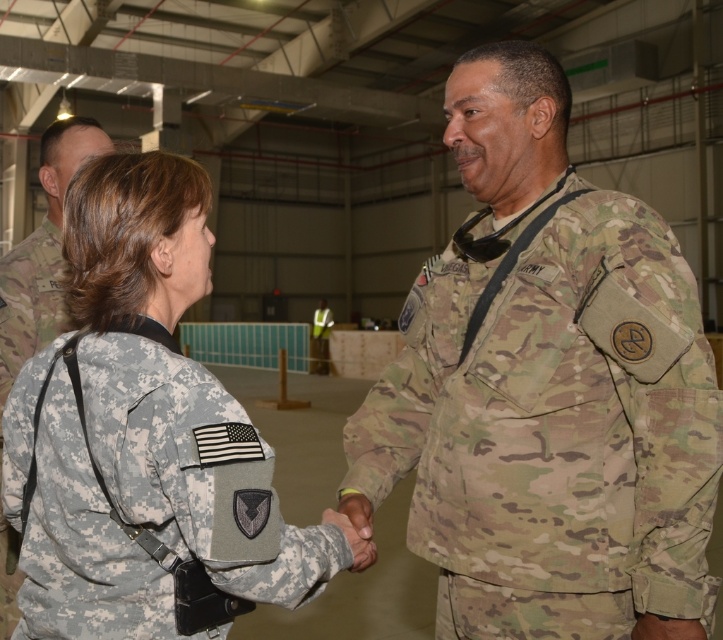
Is camo uniform at center thinner than camouflage uniform at center?

Correct, camo uniform at center's width is less than camouflage uniform at center's.

Between point (603, 252) and point (1, 413), which one is positioned in front?

Point (603, 252)

Which is behind, point (427, 353) or point (12, 596)?

The point (12, 596) is more distant.

Locate an element on the screen. camo uniform at center is located at coordinates (547, 392).

Can you confirm if camouflage fabric uniform at center is taller than camouflage uniform at center?

No.

Between point (192, 380) and point (43, 156), which one is positioned behind?

The point (43, 156) is behind.

At what (x,y) coordinates should I click in order to perform the action: click on camouflage fabric uniform at center. Please return your answer as a coordinate pair (x, y). This screenshot has width=723, height=640. Looking at the image, I should click on (145, 497).

Does camo uniform at center have a lesser height compared to camouflage fabric uniform at center?

Incorrect, camo uniform at center's height does not fall short of camouflage fabric uniform at center's.

Which is behind, point (576, 451) or point (150, 317)?

Point (576, 451)

Image resolution: width=723 pixels, height=640 pixels. Describe the element at coordinates (547, 392) in the screenshot. I see `camo uniform at center` at that location.

Find the location of `camo uniform at center`. camo uniform at center is located at coordinates (547, 392).